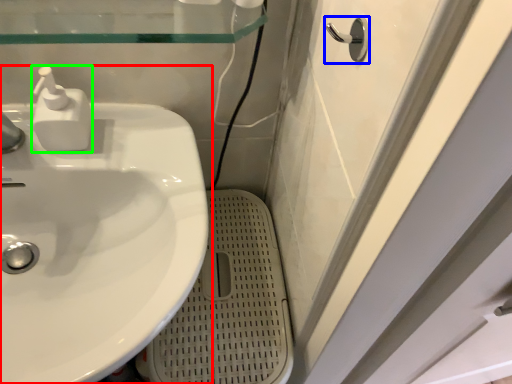
Question: Estimate the real-world distances between objects in this image. Which object is farther from sink (highlighted by a red box), door handle (highlighted by a blue box) or soap dispenser (highlighted by a green box)?

Choices:
 (A) door handle
 (B) soap dispenser

Answer: (A)